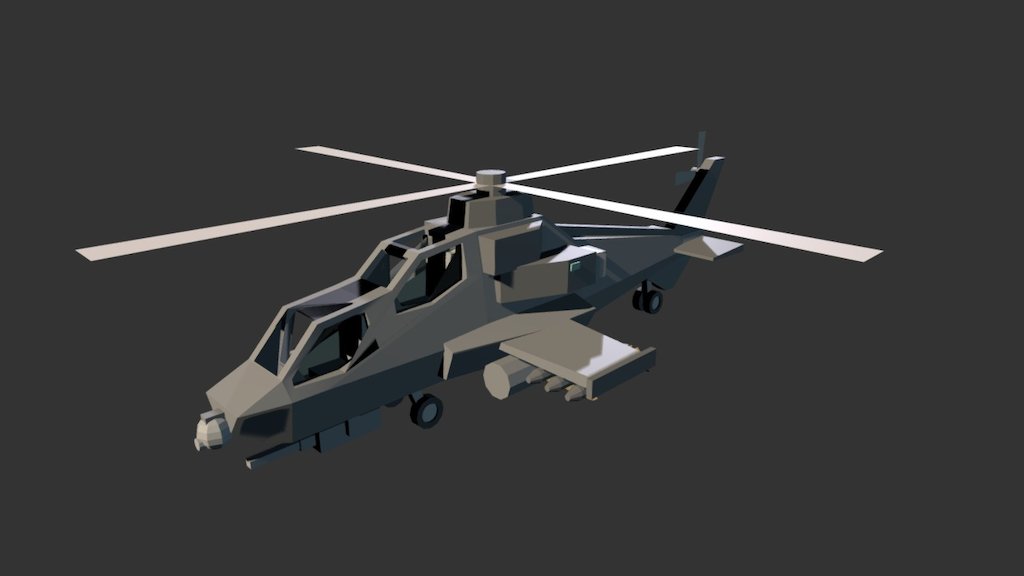
Where is `window`? window is located at coordinates (338, 343), (288, 324), (388, 263), (429, 269), (427, 240).